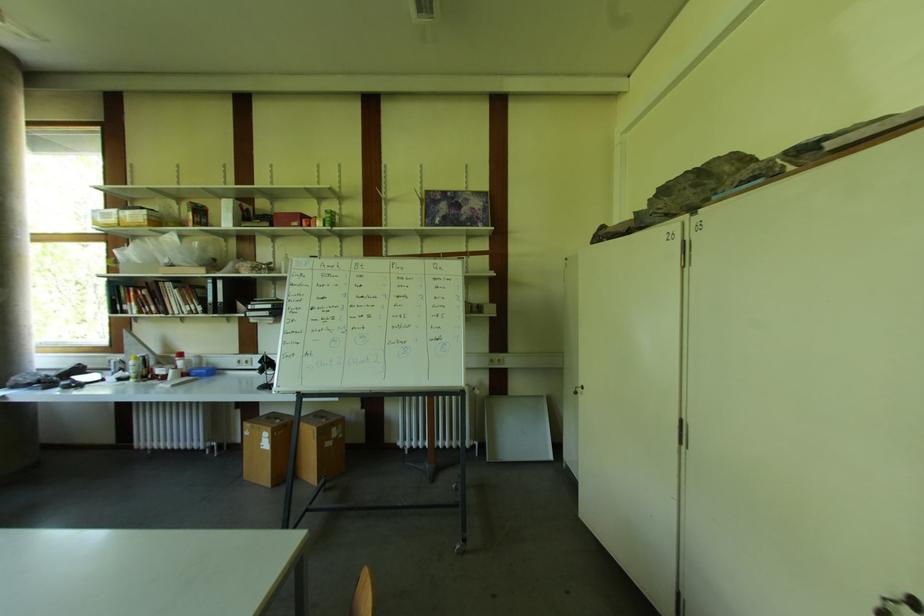
Where would you lift the book on the top shelf? Please return your answer as a coordinate pair (x, y).

(197, 214)